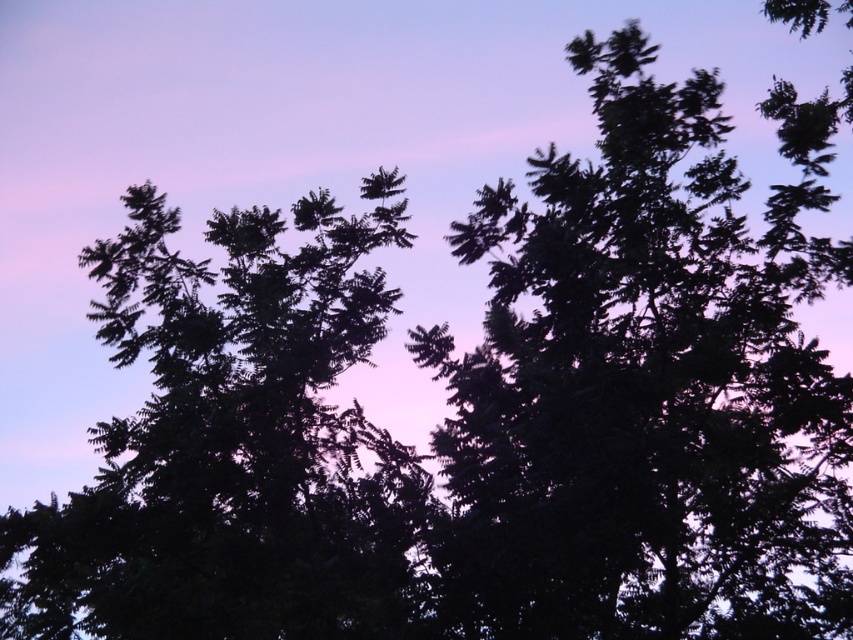
Question: Which point is farther from the camera taking this photo?

Choices:
 (A) (149, 348)
 (B) (606, 340)

Answer: (A)

Question: Does dark green foliage at center appear over dark green leafy tree at upper left?

Choices:
 (A) yes
 (B) no

Answer: (A)

Question: Which of the following is the farthest from the observer?

Choices:
 (A) dark green foliage at center
 (B) dark green leafy tree at upper left

Answer: (B)

Question: Is dark green foliage at center above dark green leafy tree at upper left?

Choices:
 (A) no
 (B) yes

Answer: (B)

Question: Observing the image, what is the correct spatial positioning of dark green foliage at center in reference to dark green leafy tree at upper left?

Choices:
 (A) left
 (B) right

Answer: (B)

Question: Among these objects, which one is nearest to the camera?

Choices:
 (A) dark green foliage at center
 (B) dark green leafy tree at upper left

Answer: (A)